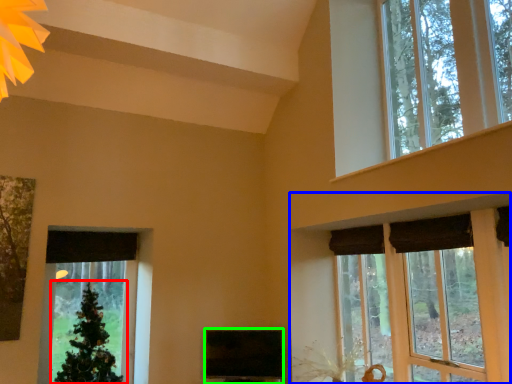
Question: Considering the real-world distances, which object is closest to christmas tree (highlighted by a red box)? window (highlighted by a blue box) or window screen (highlighted by a green box).

Choices:
 (A) window
 (B) window screen

Answer: (B)